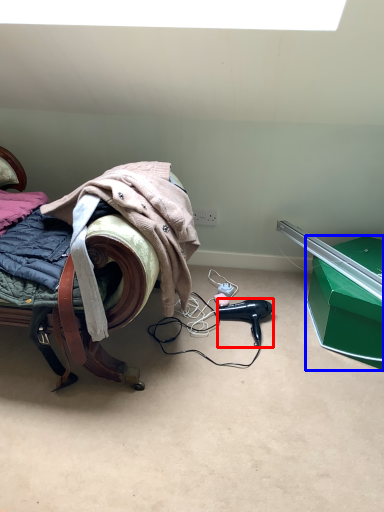
Question: Which object is further to the camera taking this photo, hair dryer (highlighted by a red box) or box (highlighted by a blue box)?

Choices:
 (A) hair dryer
 (B) box

Answer: (A)